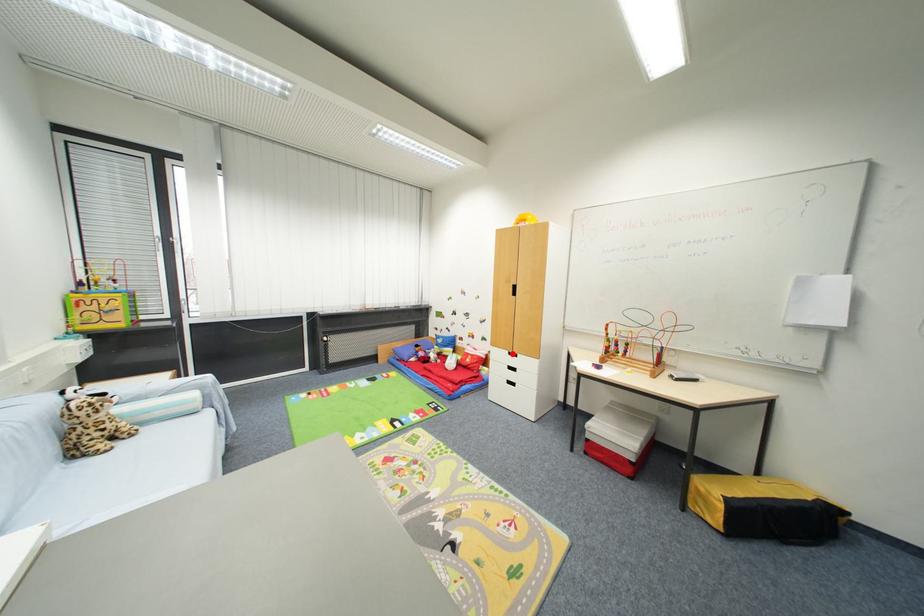
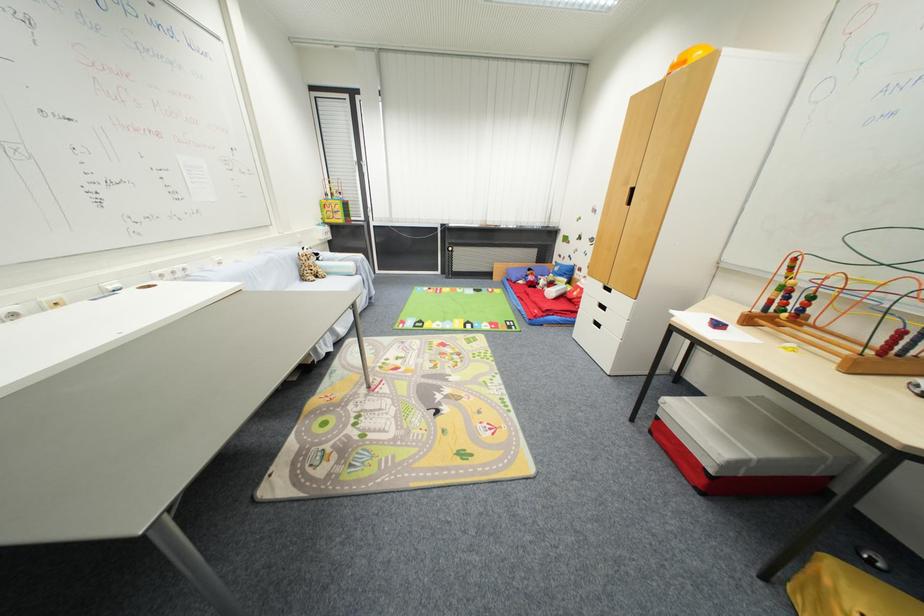
In the second image, find the point that corresponds to the highlighted location in the first image.

(606, 286)